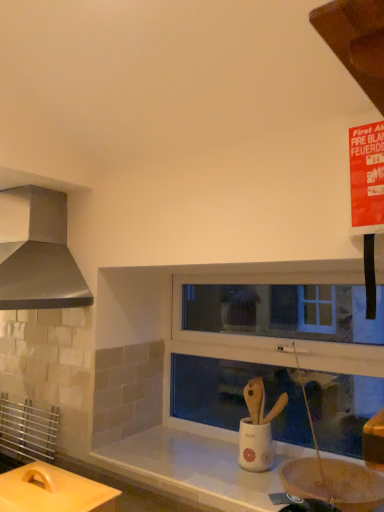
Question: Can you confirm if white ceramic sink at center is thinner than white plastic window frame at center?

Choices:
 (A) yes
 (B) no

Answer: (B)

Question: Does white ceramic sink at center turn towards white plastic window frame at center?

Choices:
 (A) no
 (B) yes

Answer: (A)

Question: Does white ceramic sink at center have a lesser height compared to white plastic window frame at center?

Choices:
 (A) yes
 (B) no

Answer: (A)

Question: Would you say white ceramic sink at center is outside white plastic window frame at center?

Choices:
 (A) yes
 (B) no

Answer: (A)

Question: From a real-world perspective, is white ceramic sink at center below white plastic window frame at center?

Choices:
 (A) yes
 (B) no

Answer: (A)

Question: Visually, is matte yellow cutting board at lower left positioned to the left or to the right of metallic stainless steel range hood at left?

Choices:
 (A) left
 (B) right

Answer: (B)

Question: From the image's perspective, is matte yellow cutting board at lower left above or below metallic stainless steel range hood at left?

Choices:
 (A) below
 (B) above

Answer: (A)

Question: Is matte yellow cutting board at lower left spatially inside metallic stainless steel range hood at left, or outside of it?

Choices:
 (A) outside
 (B) inside

Answer: (A)

Question: From a real-world perspective, is matte yellow cutting board at lower left physically located above or below metallic stainless steel range hood at left?

Choices:
 (A) above
 (B) below

Answer: (B)

Question: From a real-world perspective, is white ceramic sink at center positioned above or below metallic stainless steel range hood at left?

Choices:
 (A) below
 (B) above

Answer: (A)

Question: Does point (258, 434) appear closer or farther from the camera than point (36, 298)?

Choices:
 (A) farther
 (B) closer

Answer: (B)

Question: Considering their positions, is white ceramic sink at center located in front of or behind metallic stainless steel range hood at left?

Choices:
 (A) behind
 (B) front

Answer: (A)

Question: From the image's perspective, relative to metallic stainless steel range hood at left, is white ceramic sink at center above or below?

Choices:
 (A) above
 (B) below

Answer: (B)

Question: Considering the positions of point (1, 258) and point (244, 321), is point (1, 258) closer or farther from the camera than point (244, 321)?

Choices:
 (A) closer
 (B) farther

Answer: (A)

Question: Which is correct: metallic stainless steel range hood at left is inside white plastic window frame at center, or outside of it?

Choices:
 (A) inside
 (B) outside

Answer: (B)